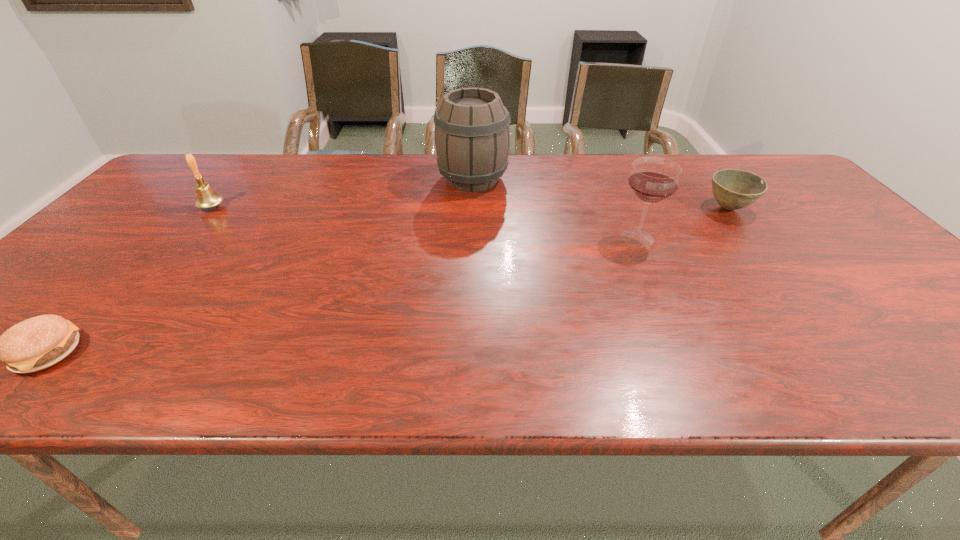
Locate an element on the screen. blank space located on the left of the bowl is located at coordinates (623, 208).

Locate an element on the screen. The image size is (960, 540). object that is positioned at the far edge is located at coordinates (472, 135).

In the image, there is a desktop. Where is `vacant space at the far edge`? This screenshot has width=960, height=540. vacant space at the far edge is located at coordinates (696, 186).

In the image, there is a desktop. In order to click on free space at the near edge in this screenshot , I will do `click(427, 372)`.

In the image, there is a desktop. Where is `free space at the right edge`? free space at the right edge is located at coordinates (797, 198).

Where is `blank area at the far left corner`? Image resolution: width=960 pixels, height=540 pixels. blank area at the far left corner is located at coordinates (180, 176).

This screenshot has height=540, width=960. In the image, there is a desktop. Find the location of `vacant region at the near right corner`. vacant region at the near right corner is located at coordinates (923, 369).

Where is `free space between the second tallest object and the second shortest object`? free space between the second tallest object and the second shortest object is located at coordinates (683, 223).

You are a GUI agent. You are given a task and a screenshot of the screen. Output one action in this format:
    pyautogui.click(x=<x>, y=<y>)
    Task: Click on the vacant space in between the third shortest object and the second shortest object
    Image resolution: width=960 pixels, height=540 pixels.
    Given the screenshot: What is the action you would take?
    pyautogui.click(x=470, y=208)

In order to click on free space between the second nearest object and the bell in this screenshot , I will do `click(424, 222)`.